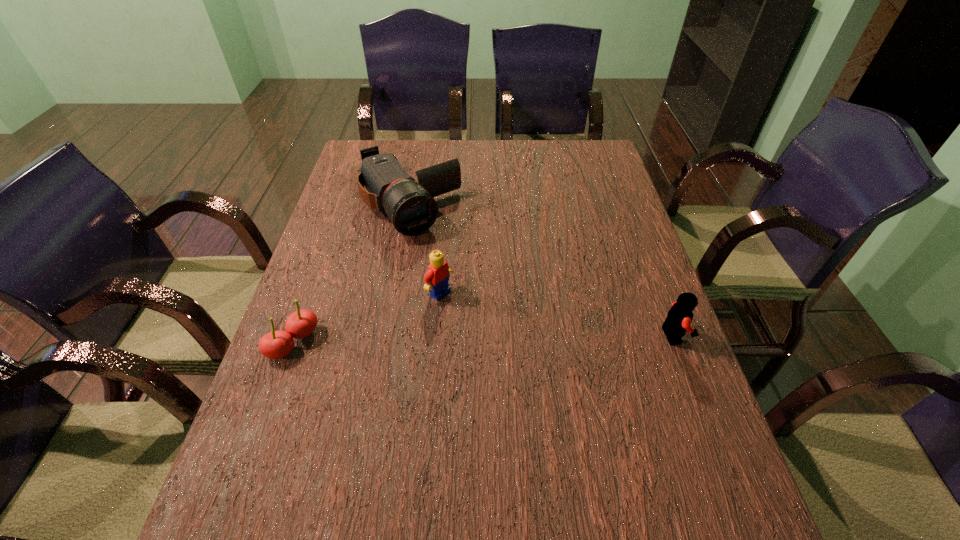
I want to click on vacant space at the left edge of the desktop, so click(x=303, y=391).

In the image, there is a desktop. Where is `free space at the right edge`? The image size is (960, 540). free space at the right edge is located at coordinates (604, 258).

Identify the location of vacant area at the far left corner of the desktop. The height and width of the screenshot is (540, 960). (367, 147).

Find the location of a particular element. vacant area that lies between the third nearest object and the camcorder is located at coordinates (424, 249).

You are a GUI agent. You are given a task and a screenshot of the screen. Output one action in this format:
    pyautogui.click(x=<x>, y=<y>)
    Task: Click on the unoccupied position between the camcorder and the right Lego
    The height and width of the screenshot is (540, 960).
    Given the screenshot: What is the action you would take?
    pyautogui.click(x=541, y=271)

Where is `free area in between the rightmost object and the farther Lego`? The height and width of the screenshot is (540, 960). free area in between the rightmost object and the farther Lego is located at coordinates (557, 314).

Image resolution: width=960 pixels, height=540 pixels. I want to click on unoccupied area between the camcorder and the left Lego, so click(x=424, y=249).

At what (x,y) coordinates should I click in order to perform the action: click on free space between the nearer Lego and the cherry. Please return your answer as a coordinate pair (x, y). This screenshot has height=540, width=960. Looking at the image, I should click on (484, 339).

At what (x,y) coordinates should I click in order to perform the action: click on free space between the left Lego and the camcorder. Please return your answer as a coordinate pair (x, y). The image size is (960, 540). Looking at the image, I should click on (424, 249).

You are a GUI agent. You are given a task and a screenshot of the screen. Output one action in this format:
    pyautogui.click(x=<x>, y=<y>)
    Task: Click on the blank region between the farthest object and the nearer Lego
    
    Given the screenshot: What is the action you would take?
    pyautogui.click(x=541, y=271)